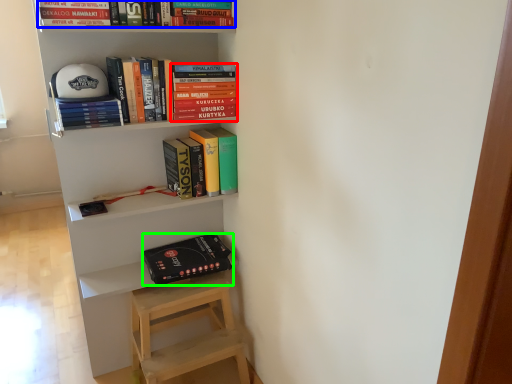
Question: Based on their relative distances, which object is nearer to book (highlighted by a red box)? Choose from book (highlighted by a blue box) and paperback book (highlighted by a green box).

Choices:
 (A) book
 (B) paperback book

Answer: (A)